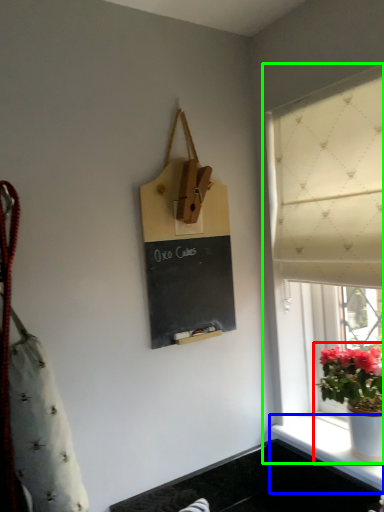
Question: Based on their relative distances, which object is nearer to houseplant (highlighted by a red box)? Choose from window sill (highlighted by a blue box) and window (highlighted by a green box).

Choices:
 (A) window sill
 (B) window

Answer: (A)